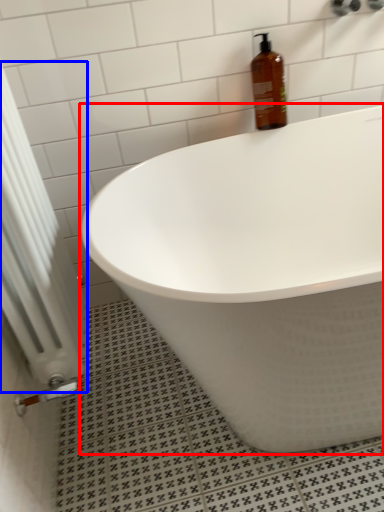
Question: Which of the following is the closest to the observer, bathtub (highlighted by a red box) or radiator (highlighted by a blue box)?

Choices:
 (A) bathtub
 (B) radiator

Answer: (B)